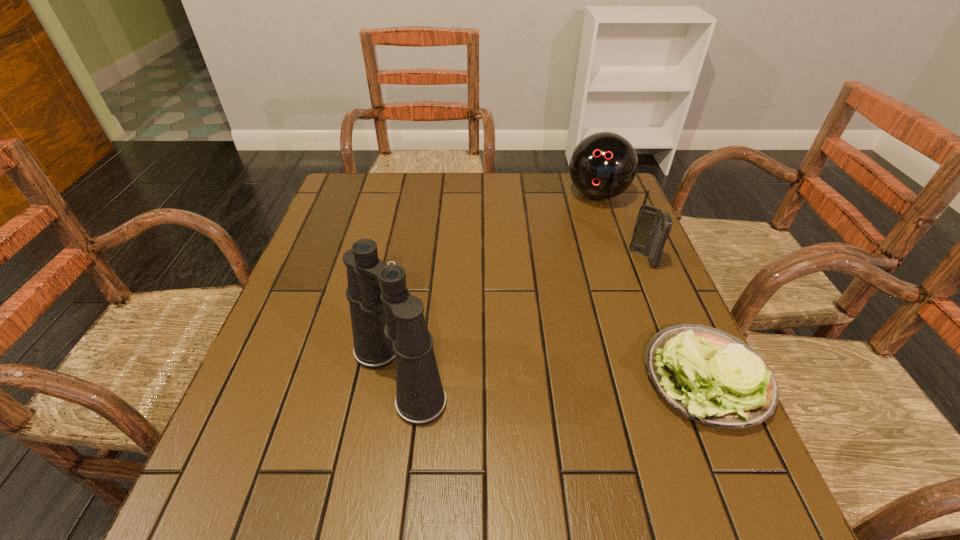
Locate an element on the screen. free space located on the surface of the farthest object near the finger holes is located at coordinates (584, 228).

The width and height of the screenshot is (960, 540). In order to click on free space located 0.130m on the surface of the farthest object near the finger holes in this screenshot , I will do `click(580, 237)`.

Find the location of a particular element. free spot located on the surface of the farthest object near the finger holes is located at coordinates (577, 243).

I want to click on object that is at the far edge, so click(x=603, y=165).

You are a GUI agent. You are given a task and a screenshot of the screen. Output one action in this format:
    pyautogui.click(x=<x>, y=<y>)
    Task: Click on the binoculars at the near edge
    This screenshot has height=540, width=960.
    Given the screenshot: What is the action you would take?
    pyautogui.click(x=388, y=323)

Locate an element on the screen. lettuce that is at the near edge is located at coordinates (712, 377).

Identify the location of lettuce located at the right edge. (712, 377).

At what (x,y) coordinates should I click in order to perform the action: click on cellular telephone that is at the right edge. Please return your answer as a coordinate pair (x, y). Looking at the image, I should click on (653, 227).

You are a GUI agent. You are given a task and a screenshot of the screen. Output one action in this format:
    pyautogui.click(x=<x>, y=<y>)
    Task: Click on the bowling ball that is at the right edge
    
    Given the screenshot: What is the action you would take?
    pyautogui.click(x=603, y=165)

Where is `object that is positioned at the far right corner`? This screenshot has height=540, width=960. object that is positioned at the far right corner is located at coordinates (603, 165).